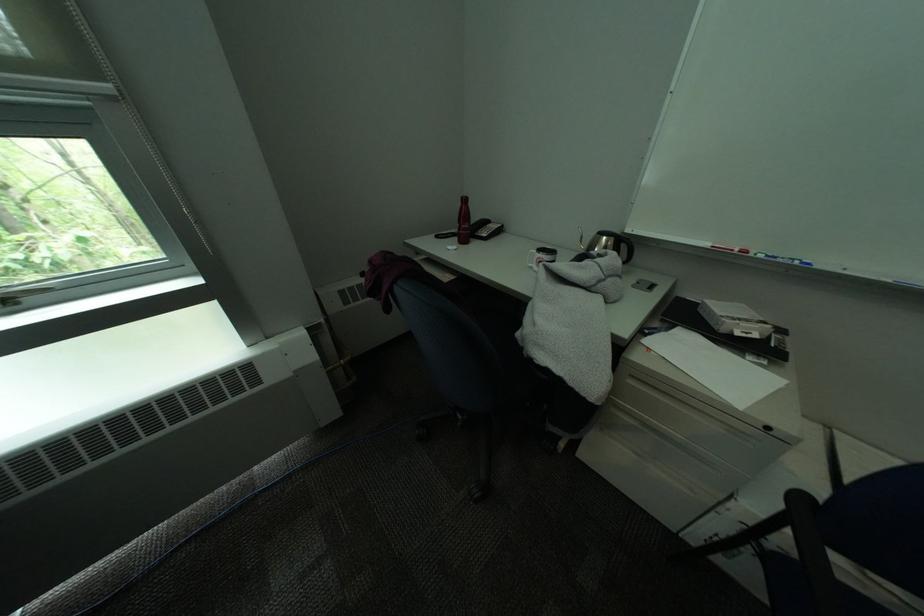
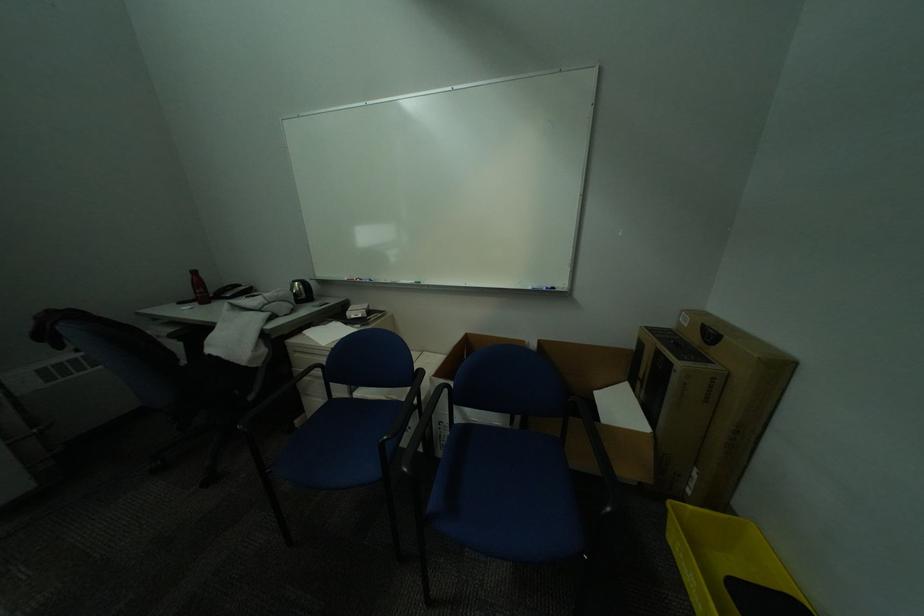
In the second image, find the point that corresponds to (x=570, y=445) in the first image.

(306, 423)